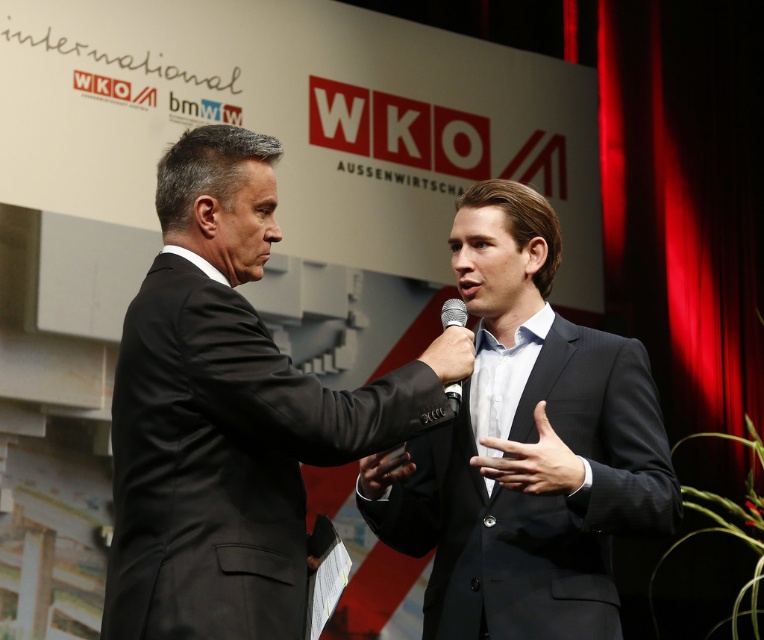
Question: Observing the image, what is the correct spatial positioning of black matte microphone at center in reference to silver metallic microphone at center?

Choices:
 (A) left
 (B) right

Answer: (A)

Question: Which point appears closest to the camera in this image?

Choices:
 (A) (436, 337)
 (B) (573, 474)

Answer: (B)

Question: Does black smooth suit at center have a smaller size compared to silver metallic microphone at center?

Choices:
 (A) no
 (B) yes

Answer: (A)

Question: Which point is closer to the camera taking this photo?

Choices:
 (A) (429, 364)
 (B) (241, 356)

Answer: (B)

Question: Can you confirm if black suit at center is smaller than black matte microphone at center?

Choices:
 (A) yes
 (B) no

Answer: (B)

Question: Based on their relative distances, which object is farther from the black suit at center?

Choices:
 (A) black plastic microphone at center
 (B) black smooth suit at center

Answer: (A)